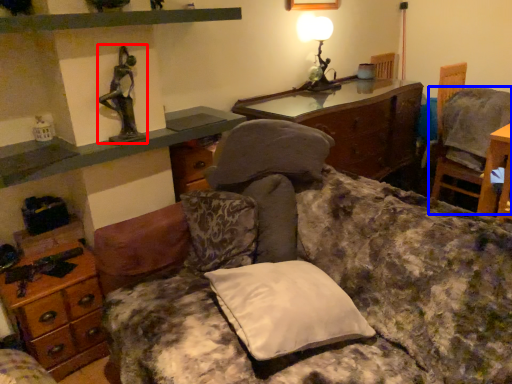
Question: Among these objects, which one is nearest to the camera, person (highlighted by a red box) or chair (highlighted by a blue box)?

Choices:
 (A) person
 (B) chair

Answer: (A)